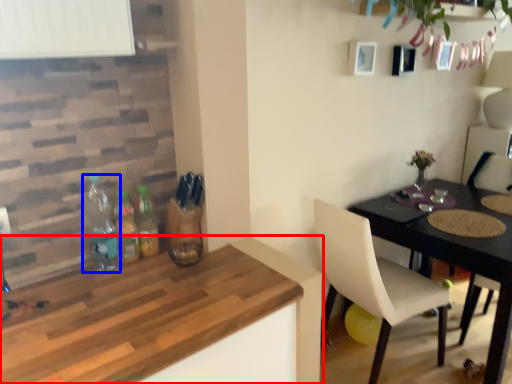
Question: Which of the following is the farthest to the observer, kitchen & dining room table (highlighted by a red box) or bottle (highlighted by a blue box)?

Choices:
 (A) kitchen & dining room table
 (B) bottle

Answer: (B)